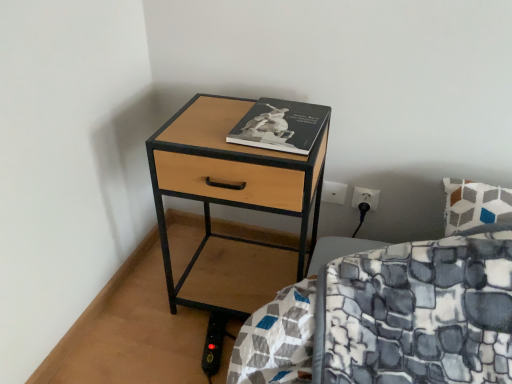
Image resolution: width=512 pixels, height=384 pixels. Find the location of `free point above woodenmaterial/texturenightstand at lower left (from a real-world perspective)`. free point above woodenmaterial/texturenightstand at lower left (from a real-world perspective) is located at coordinates (236, 122).